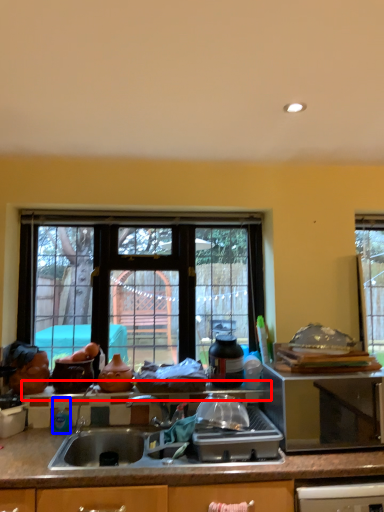
Question: Among these objects, which one is farthest to the camera, window sill (highlighted by a red box) or bottle (highlighted by a blue box)?

Choices:
 (A) window sill
 (B) bottle

Answer: (A)